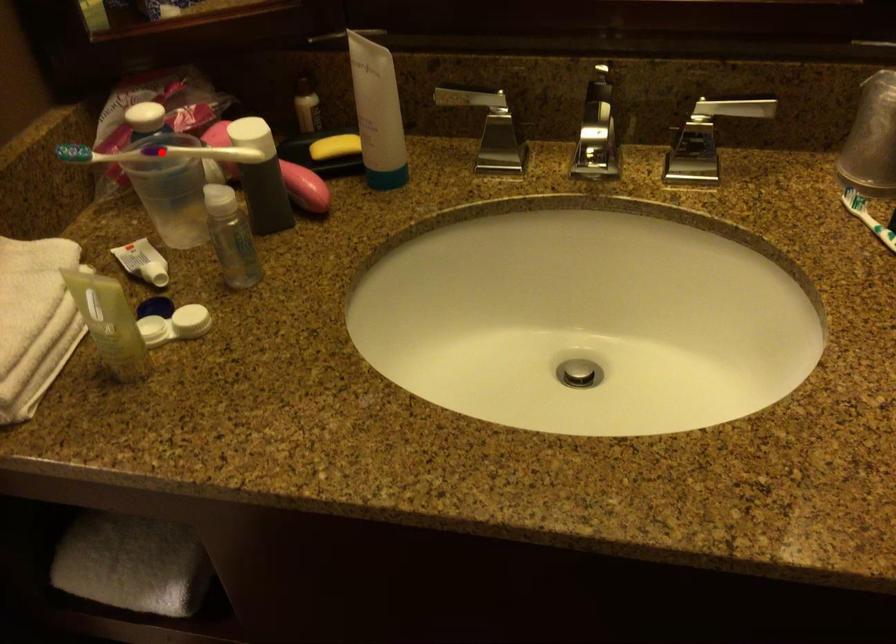
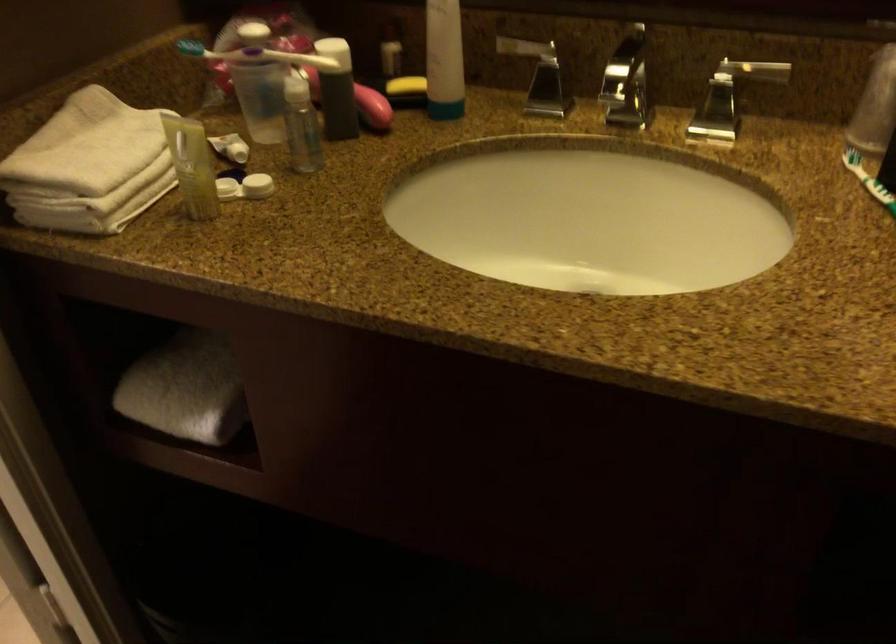
Question: I am providing you with two images of the same scene from different viewpoints. A red point is marked on the first image. Is the red point's position out of view in image 2?

Choices:
 (A) Yes
 (B) No

Answer: (B)